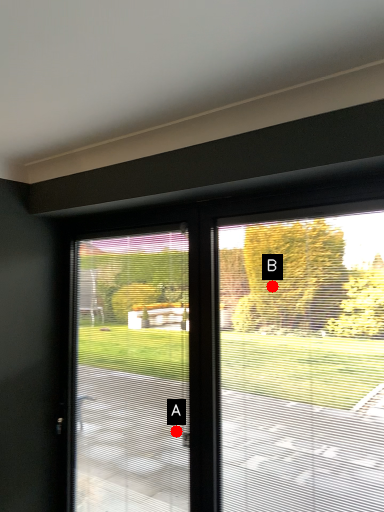
Question: Two points are circled on the image, labeled by A and B beside each circle. Which point is farther to the camera?

Choices:
 (A) A is further
 (B) B is further

Answer: (B)